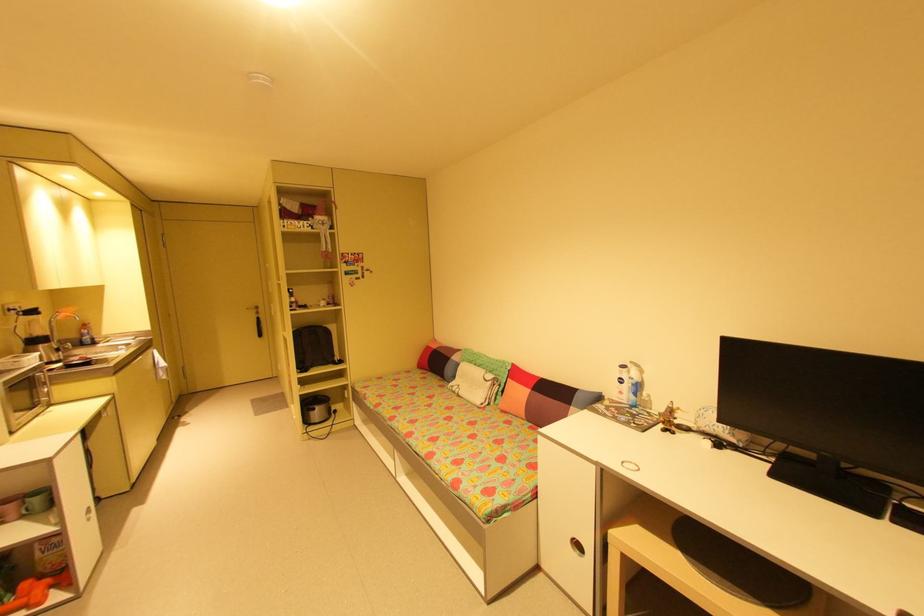
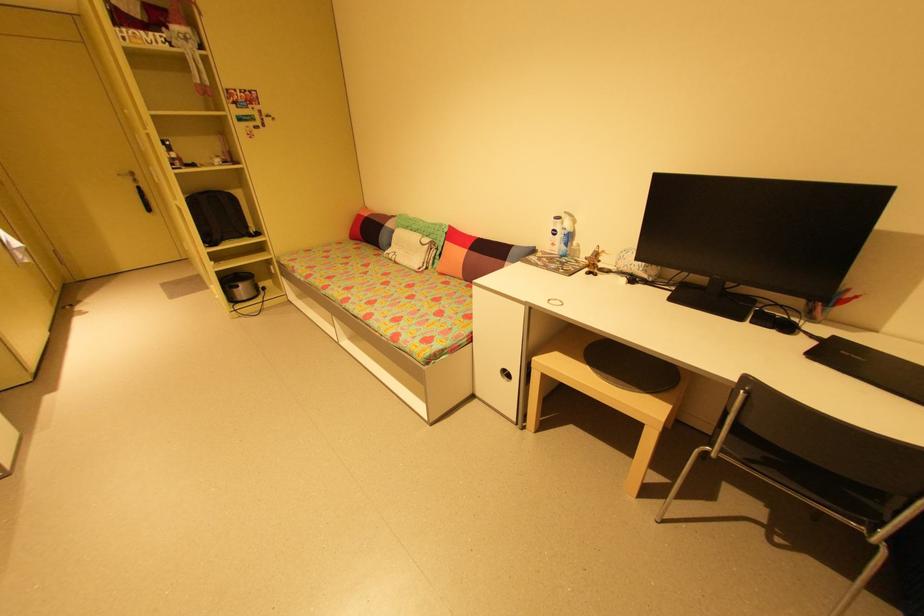
The point at (315, 413) is marked in the first image. Where is the corresponding point in the second image?

(239, 291)